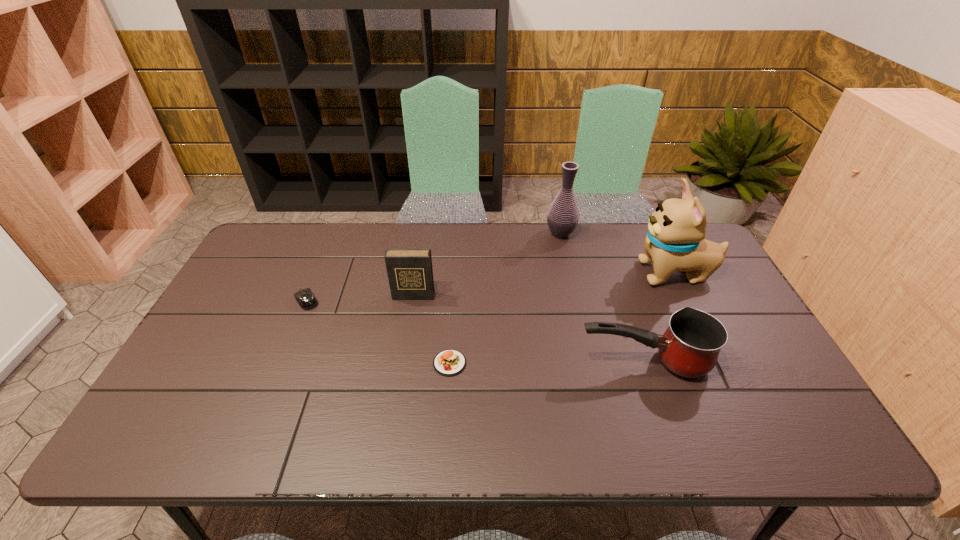
Identify the location of puppy. This screenshot has height=540, width=960. (675, 241).

I want to click on the fifth shortest object, so click(563, 215).

Where is `vase`? vase is located at coordinates (x=563, y=215).

Where is `the fifth object from right to left`? the fifth object from right to left is located at coordinates (410, 274).

Image resolution: width=960 pixels, height=540 pixels. Find the location of `the third shortest object`. the third shortest object is located at coordinates (690, 346).

Locate an element on the screen. The image size is (960, 540). the fifth tallest object is located at coordinates (305, 298).

This screenshot has height=540, width=960. I want to click on mouse, so click(x=305, y=298).

You are a GUI agent. You are given a task and a screenshot of the screen. Output one action in this format:
    pyautogui.click(x=<x>, y=<y>)
    Task: Click on the patty (food)
    Image resolution: width=960 pixels, height=540 pixels.
    Given the screenshot: What is the action you would take?
    pyautogui.click(x=449, y=362)

You are a GUI agent. You are given a task and a screenshot of the screen. Output one action in this format:
    pyautogui.click(x=<x>, y=<y>)
    Task: Click on the third object from left to right
    This screenshot has width=960, height=540.
    Given the screenshot: What is the action you would take?
    pyautogui.click(x=449, y=362)

Find the location of `vacant region located 0.090m on the face of the puppy`. vacant region located 0.090m on the face of the puppy is located at coordinates (606, 274).